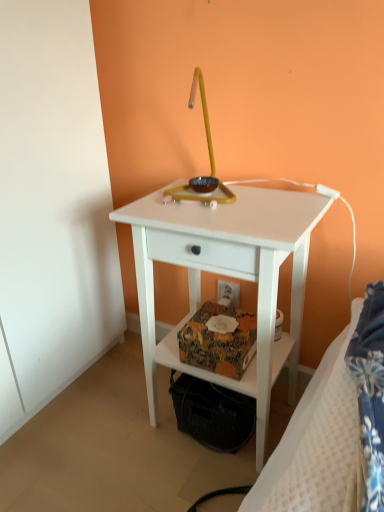
Question: Considering the relative sizes of white matte nightstand at center and white textured bed at lower right in the image provided, is white matte nightstand at center thinner than white textured bed at lower right?

Choices:
 (A) yes
 (B) no

Answer: (B)

Question: Considering the relative sizes of white matte nightstand at center and white textured bed at lower right in the image provided, is white matte nightstand at center bigger than white textured bed at lower right?

Choices:
 (A) no
 (B) yes

Answer: (B)

Question: From the image's perspective, is white matte nightstand at center located beneath white textured bed at lower right?

Choices:
 (A) no
 (B) yes

Answer: (A)

Question: Is white matte nightstand at center wider than white textured bed at lower right?

Choices:
 (A) yes
 (B) no

Answer: (A)

Question: From the image's perspective, is white matte nightstand at center on white textured bed at lower right?

Choices:
 (A) no
 (B) yes

Answer: (B)

Question: Is white matte nightstand at center facing towards white textured bed at lower right?

Choices:
 (A) no
 (B) yes

Answer: (A)

Question: From a real-world perspective, is white plastic electric outlet at lower center under white matte nightstand at center?

Choices:
 (A) no
 (B) yes

Answer: (B)

Question: Would you say white plastic electric outlet at lower center contains white matte nightstand at center?

Choices:
 (A) no
 (B) yes

Answer: (A)

Question: From the image's perspective, does white plastic electric outlet at lower center appear lower than white matte nightstand at center?

Choices:
 (A) no
 (B) yes

Answer: (A)

Question: Is white plastic electric outlet at lower center behind white matte nightstand at center?

Choices:
 (A) yes
 (B) no

Answer: (A)

Question: Does white plastic electric outlet at lower center appear on the left side of white matte nightstand at center?

Choices:
 (A) no
 (B) yes

Answer: (A)

Question: Is white plastic electric outlet at lower center oriented towards white matte nightstand at center?

Choices:
 (A) no
 (B) yes

Answer: (B)

Question: Is white textured bed at lower right far from white plastic electric outlet at lower center?

Choices:
 (A) yes
 (B) no

Answer: (B)